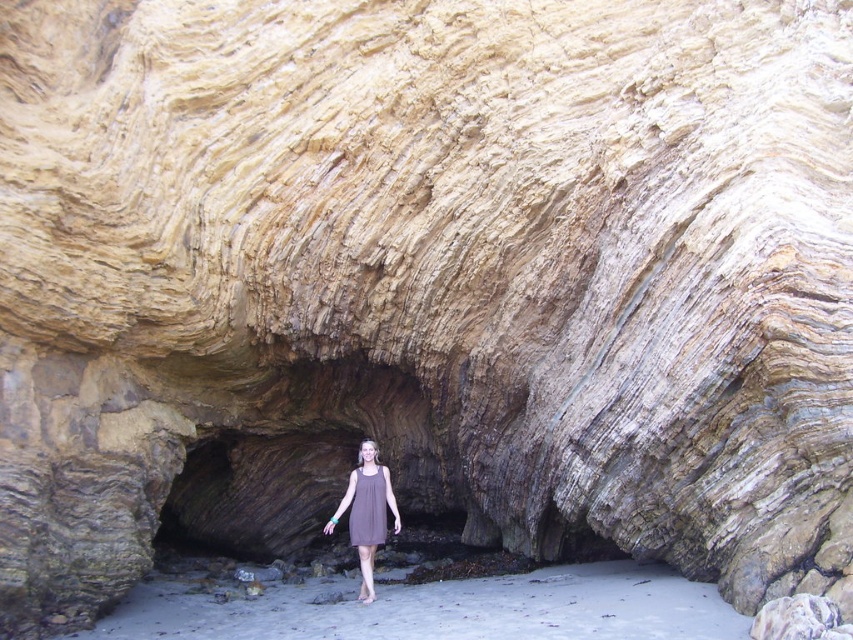
Question: Which object is positioned farthest from the purple cotton dress at center?

Choices:
 (A) sandy beach at lower center
 (B) brown fabric dress at center

Answer: (A)

Question: Does brown fabric dress at center have a smaller size compared to purple cotton dress at center?

Choices:
 (A) no
 (B) yes

Answer: (A)

Question: Can you confirm if sandy beach at lower center is thinner than brown fabric dress at center?

Choices:
 (A) no
 (B) yes

Answer: (A)

Question: Which of the following is the closest to the observer?

Choices:
 (A) (677, 602)
 (B) (346, 496)
 (C) (384, 515)

Answer: (A)

Question: Does sandy beach at lower center have a larger size compared to purple cotton dress at center?

Choices:
 (A) no
 (B) yes

Answer: (B)

Question: Which object is farther from the camera taking this photo?

Choices:
 (A) purple cotton dress at center
 (B) brown fabric dress at center
 (C) sandy beach at lower center

Answer: (A)